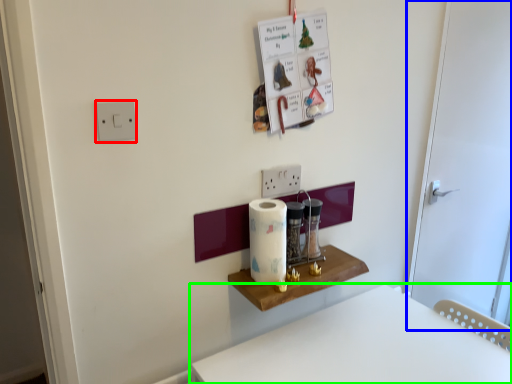
Question: Which object is positioned farthest from light switch (highlighted by a red box)? Select from door (highlighted by a blue box) and furniture (highlighted by a green box).

Choices:
 (A) door
 (B) furniture

Answer: (A)